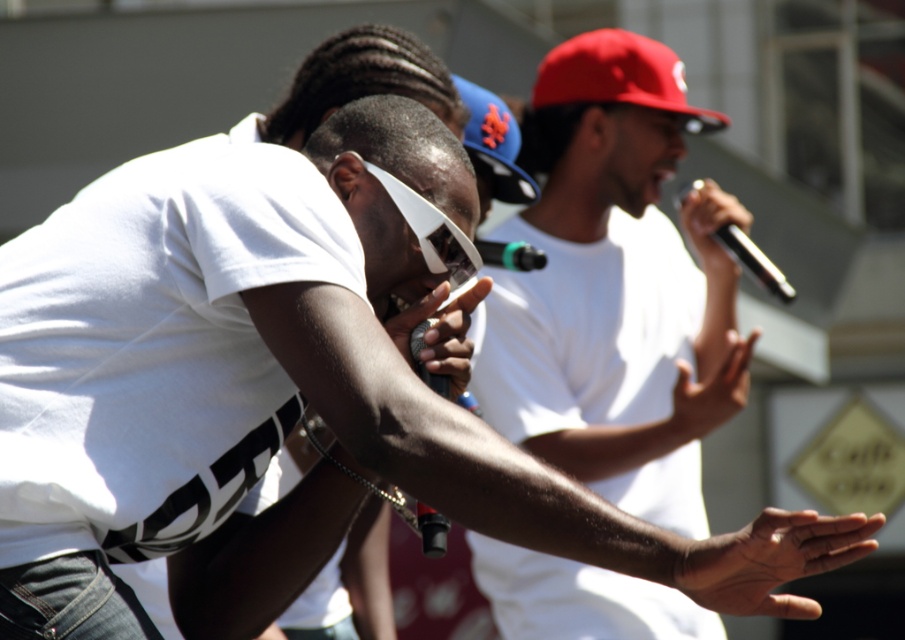
Question: Which point is closer to the camera?

Choices:
 (A) (543, 316)
 (B) (729, 252)
 (C) (496, 188)

Answer: (C)

Question: Is smooth skin hand at center thinner than black matte microphone at upper right?

Choices:
 (A) no
 (B) yes

Answer: (A)

Question: Which is farther from the blue fabric baseball cap at center?

Choices:
 (A) green matte microphone at center
 (B) matte white shirt at center
 (C) black matte microphone at upper right

Answer: (C)

Question: Does black metallic microphone at upper right have a greater width compared to green matte microphone at center?

Choices:
 (A) no
 (B) yes

Answer: (B)

Question: Which point is farther to the camera?

Choices:
 (A) (502, 260)
 (B) (717, 572)

Answer: (A)

Question: Can you confirm if black matte microphone at upper right is smaller than green matte microphone at center?

Choices:
 (A) no
 (B) yes

Answer: (A)